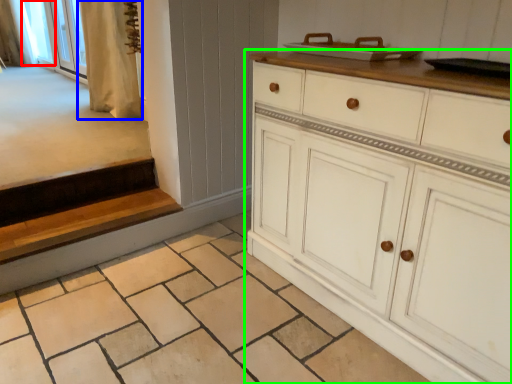
Question: Considering the real-world distances, which object is farthest from window screen (highlighted by a red box)? curtain (highlighted by a blue box) or chest of drawers (highlighted by a green box)?

Choices:
 (A) curtain
 (B) chest of drawers

Answer: (B)